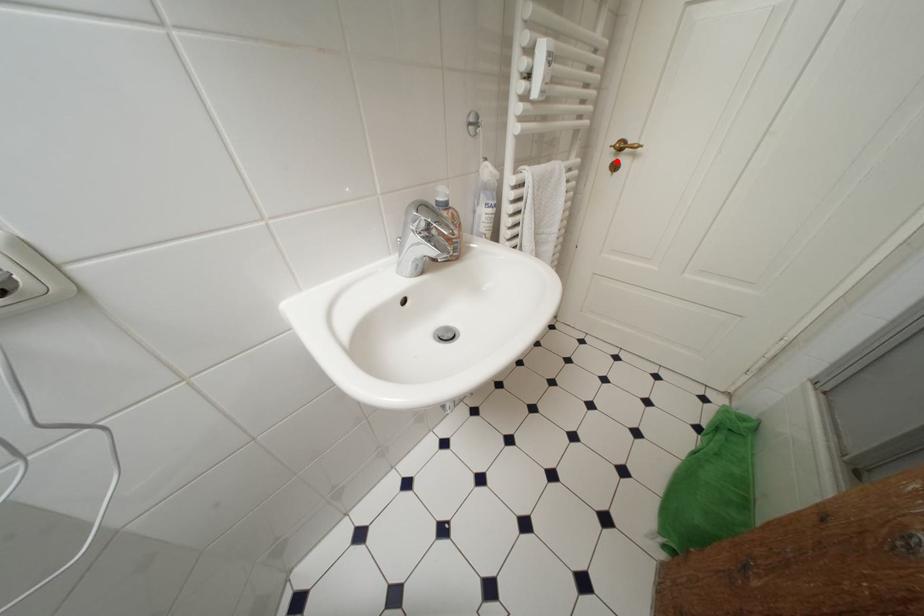
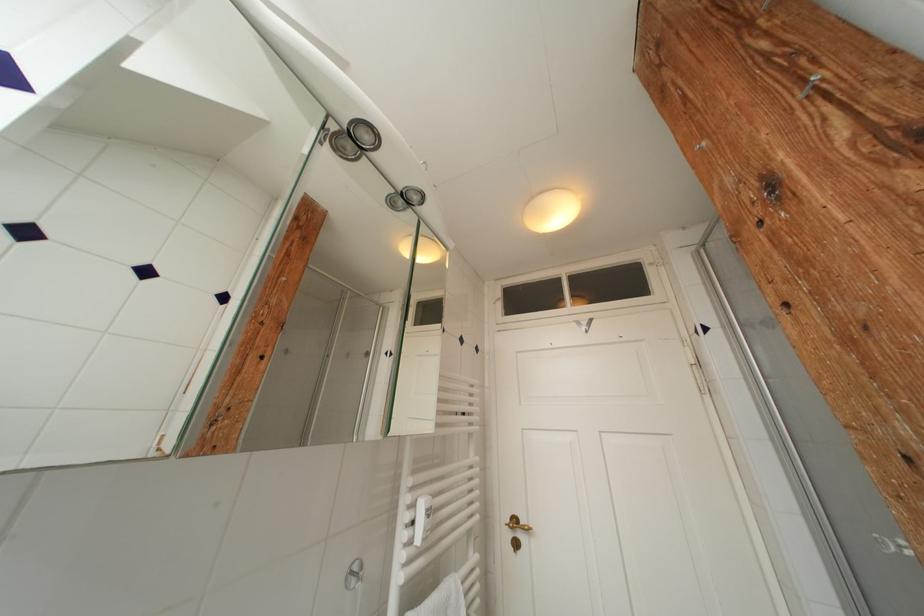
Question: I am providing you with two images of the same scene from different viewpoints. A red point is shown in image1. For the corresponding object point in image2, is it positioned nearer or farther from the camera?

Choices:
 (A) Nearer
 (B) Farther

Answer: (B)